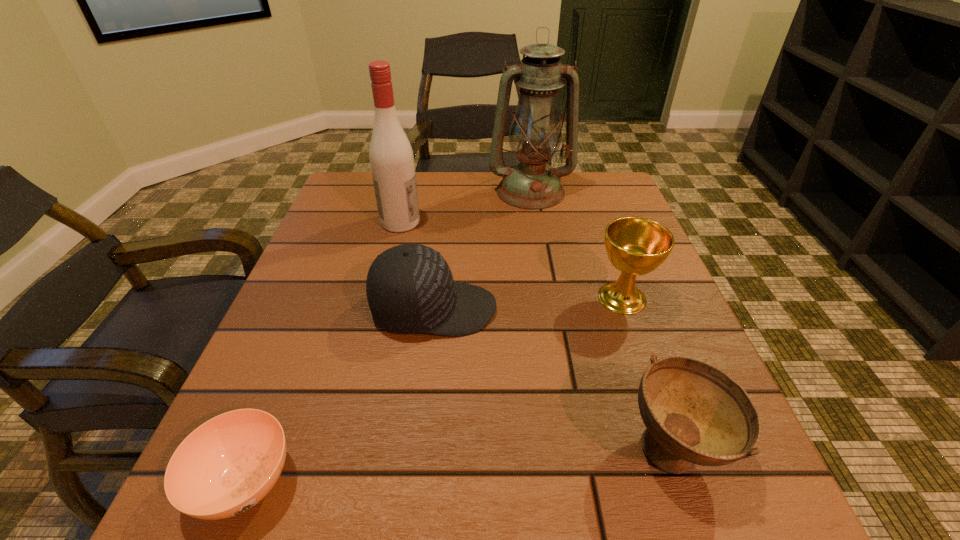
The height and width of the screenshot is (540, 960). I want to click on vacant space located at the front of the baseball cap where the brim is located, so click(650, 309).

Locate an element on the screen. The image size is (960, 540). free location located on the back of the taller soup bowl is located at coordinates (641, 353).

The height and width of the screenshot is (540, 960). Find the location of `free space located on the right of the left soup bowl`. free space located on the right of the left soup bowl is located at coordinates (348, 482).

Where is `oil lamp located at the far edge`? The image size is (960, 540). oil lamp located at the far edge is located at coordinates (535, 134).

This screenshot has width=960, height=540. What are the coordinates of `alcohol that is at the far edge` in the screenshot? It's located at (391, 157).

Locate an element on the screen. The image size is (960, 540). alcohol that is at the left edge is located at coordinates (391, 157).

The width and height of the screenshot is (960, 540). In order to click on soup bowl at the left edge in this screenshot , I will do `click(227, 465)`.

Locate an element on the screen. This screenshot has width=960, height=540. oil lamp that is at the right edge is located at coordinates (535, 134).

At what (x,y) coordinates should I click in order to perform the action: click on chalice that is at the right edge. Please return your answer as a coordinate pair (x, y). Looking at the image, I should click on click(x=635, y=246).

The image size is (960, 540). I want to click on soup bowl situated at the right edge, so click(694, 413).